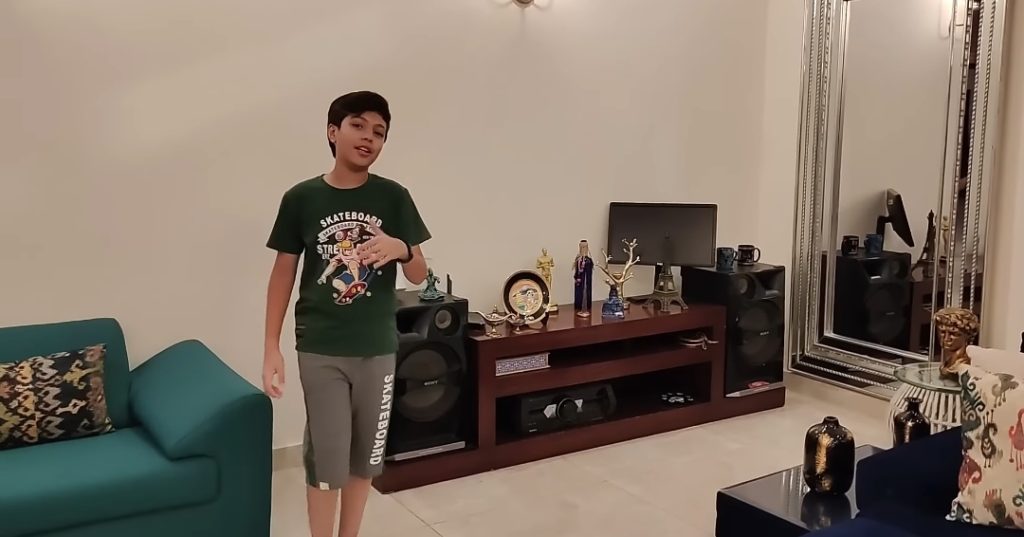
This screenshot has width=1024, height=537. I want to click on tv, so click(682, 255).